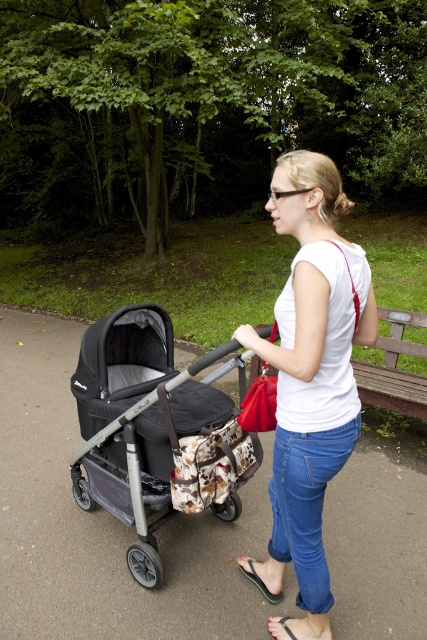
You are standing in the park and see two points marked in the image. The first point is at coordinates point (140, 371) and the second is at point (388, 374). Which point is closer to you?

Point (140, 371) is closer to the viewer than point (388, 374).

You are a photographer trying to capture the woman in the scene. You want to ensure both the white matte shirt at center and the brown wooden bench at center are clearly visible in your photo. Which object should you focus on first to ensure proper focus, considering their sizes?

The white matte shirt at center is larger in size than the brown wooden bench at center, so focusing on the white matte shirt at center first will ensure proper focus since it is the larger object and requires more attention.

You are a parent carrying a 24 inch wide box and want to place it between the smooth gray stroller at center and the brown wooden bench at center. Is there enough space?

The distance between the smooth gray stroller at center and the brown wooden bench at center is 36.90 inches. Since the box is 24 inches wide, there is enough space to place it between them.